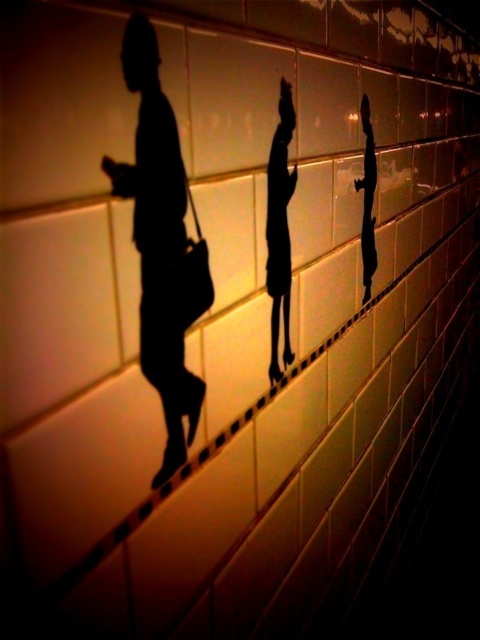
Question: Can you confirm if black silhouette at left is positioned to the right of black matte silhouette at center?

Choices:
 (A) no
 (B) yes

Answer: (A)

Question: Which of the following is the closest to the observer?

Choices:
 (A) black matte silhouette at center
 (B) black silhouette at left

Answer: (B)

Question: Can you confirm if black silhouette at left is smaller than black matte silhouette at center?

Choices:
 (A) yes
 (B) no

Answer: (B)

Question: Which point is closer to the camera taking this photo?

Choices:
 (A) [x=288, y=296]
 (B) [x=157, y=195]

Answer: (B)

Question: Is black silhouette at left thinner than black matte silhouette at center?

Choices:
 (A) yes
 (B) no

Answer: (B)